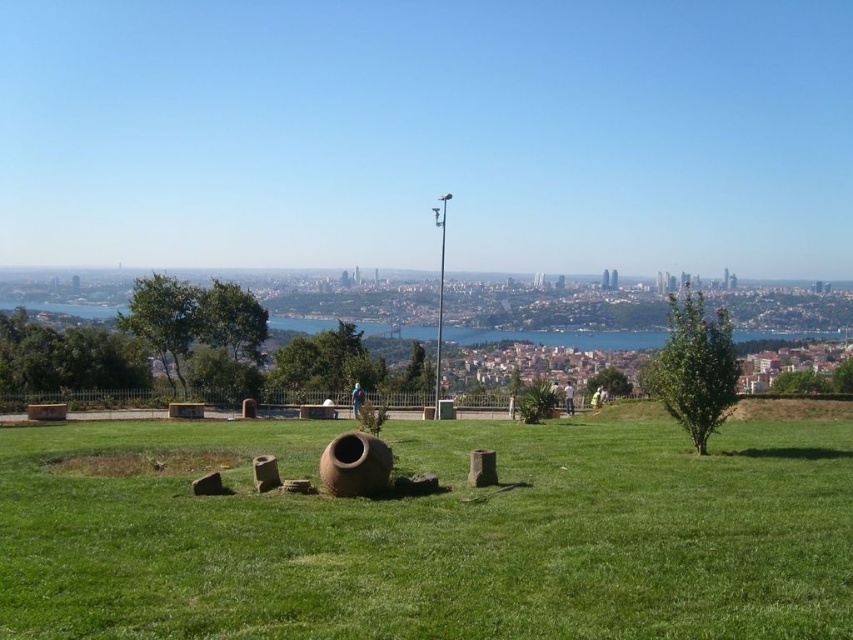
You are standing in the park and see the green grassy at center and the blue fabric person at center. Which object is located to the right side from your perspective?

The green grassy at center is to the right of the blue fabric person at center, so the green grassy at center is located to the right side from your perspective.

You are standing at the viewpoint in the park and see two points marked in the scene. Which point, point (358, 598) or point (361, 396), is closer to you?

Point (358, 598) is closer to the viewer than point (361, 396).